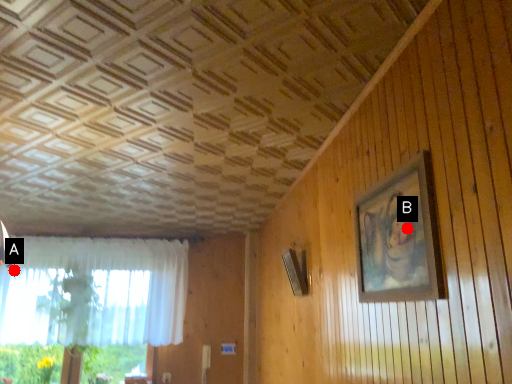
Question: Two points are circled on the image, labeled by A and B beside each circle. Which point appears closest to the camera in this image?

Choices:
 (A) A is closer
 (B) B is closer

Answer: (B)